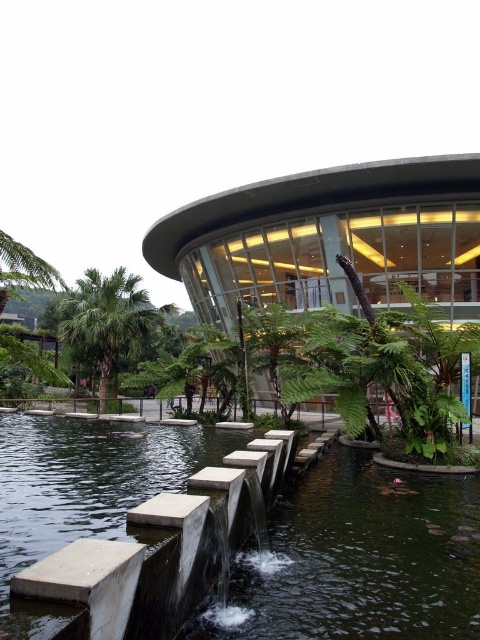
Question: Which point is closer to the camera?

Choices:
 (A) green leafy palm tree at center
 (B) smooth concrete steps at center
 (C) green leafy palm tree at left
 (D) smooth concrete pond at center

Answer: (B)

Question: Which point appears closest to the camera in this image?

Choices:
 (A) (153, 317)
 (B) (301, 360)
 (C) (191, 595)
 (D) (342, 627)

Answer: (C)

Question: Which point is farther from the camera taking this photo?

Choices:
 (A) (416, 564)
 (B) (106, 381)
 (C) (205, 468)
 (D) (285, 321)

Answer: (B)

Question: Can you confirm if green leafy palm tree at left is wider than green leafy palm tree at center?

Choices:
 (A) no
 (B) yes

Answer: (A)

Question: In this image, where is smooth concrete pond at center located relative to green leafy palm tree at center?

Choices:
 (A) below
 (B) above

Answer: (A)

Question: Is smooth concrete steps at center bigger than green leafy palm tree at center?

Choices:
 (A) no
 (B) yes

Answer: (A)